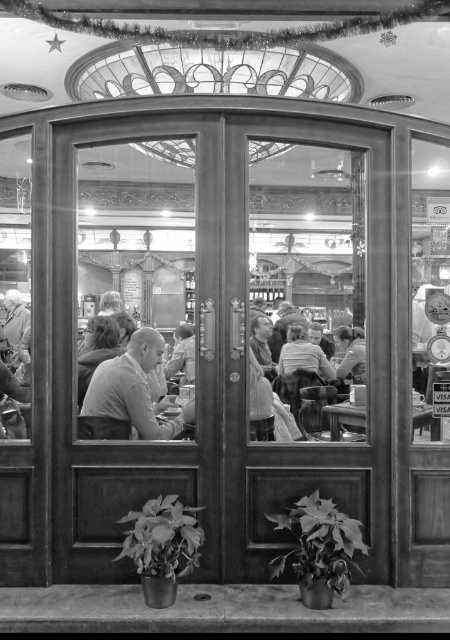
Does smooth wooden table at center come behind smooth skin person at center?

Yes, it is behind smooth skin person at center.

Based on the photo, does smooth wooden table at center have a lesser height compared to smooth skin person at center?

Yes, smooth wooden table at center is shorter than smooth skin person at center.

Describe the element at coordinates (345, 417) in the screenshot. I see `smooth wooden table at center` at that location.

This screenshot has height=640, width=450. Find the location of `smooth wooden table at center`. smooth wooden table at center is located at coordinates (345, 417).

Between smooth fabric shirt at center and smooth leather jacket at left, which one is positioned lower?

Positioned lower is smooth fabric shirt at center.

Does point (282, 369) come behind point (18, 305)?

No, it is in front of (18, 305).

Identify the location of smooth fabric shirt at center. (302, 355).

Who is more forward, (360, 364) or (188, 326)?

Positioned in front is point (360, 364).

Can you confirm if smooth skin person at center is positioned to the left of smooth beige shirt at center?

No, smooth skin person at center is not to the left of smooth beige shirt at center.

The height and width of the screenshot is (640, 450). I want to click on smooth skin person at center, so point(351,353).